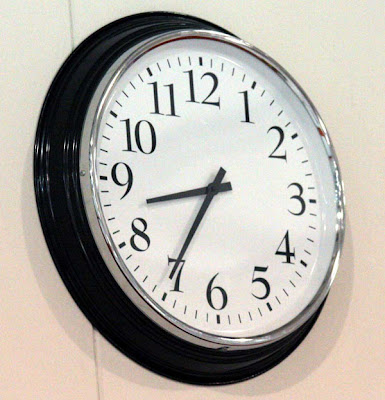
Where is `clock face`? Image resolution: width=385 pixels, height=400 pixels. clock face is located at coordinates (196, 157).